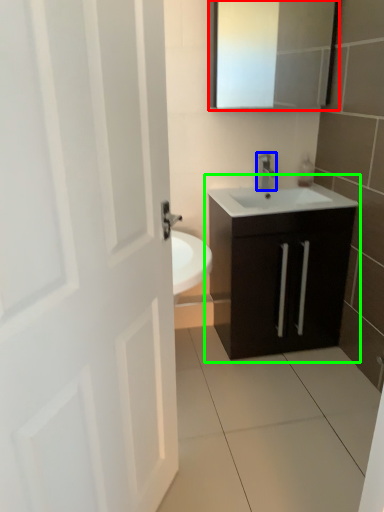
Question: Based on their relative distances, which object is farther from medicine cabinet (highlighted by a red box)? Choose from tap (highlighted by a blue box) and bathroom cabinet (highlighted by a green box).

Choices:
 (A) tap
 (B) bathroom cabinet

Answer: (B)